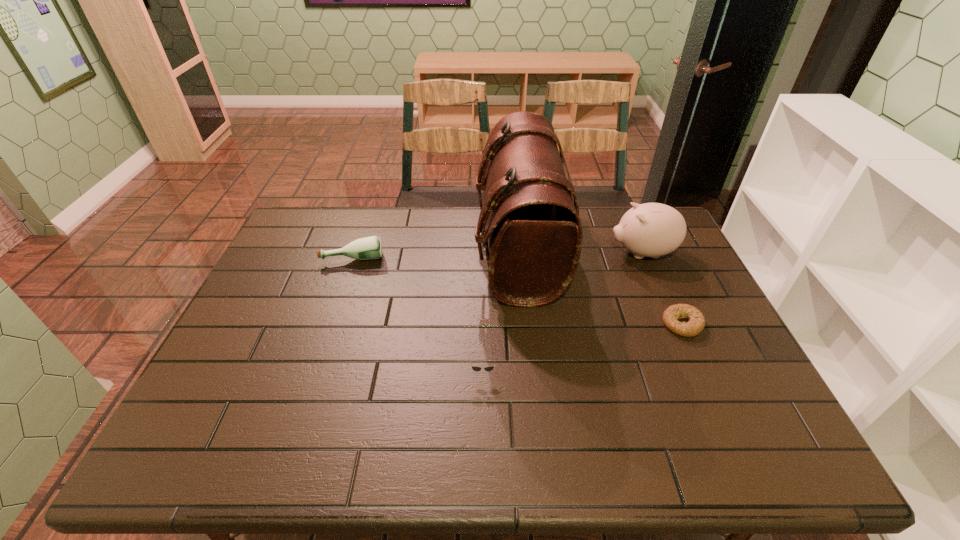
Identify the location of satchel. [x=533, y=229].

The height and width of the screenshot is (540, 960). I want to click on piggy bank, so click(652, 230).

You are a GUI agent. You are given a task and a screenshot of the screen. Output one action in this format:
    pyautogui.click(x=<x>, y=<y>)
    Task: Click on the bottle
    The width and height of the screenshot is (960, 540).
    Given the screenshot: What is the action you would take?
    pyautogui.click(x=368, y=248)

You are a GUI agent. You are given a task and a screenshot of the screen. Output one action in this format:
    pyautogui.click(x=<x>, y=<y>)
    Task: Click on the third shortest object
    
    Given the screenshot: What is the action you would take?
    pyautogui.click(x=368, y=248)

Find the location of a particular element. sunglasses is located at coordinates (476, 368).

Identify the location of the fourth tallest object. (476, 368).

Locate an element on the screen. This screenshot has height=540, width=960. the shortest object is located at coordinates (695, 325).

Locate an element on the screen. The image size is (960, 540). free space located 0.230m on the front-facing side of the satchel is located at coordinates (405, 251).

The width and height of the screenshot is (960, 540). Identify the location of vacant space located on the front-facing side of the satchel. (387, 251).

At what (x,y) coordinates should I click in order to perform the action: click on free region located 0.080m on the front-facing side of the satchel. Please return your answer as a coordinate pair (x, y). The width and height of the screenshot is (960, 540). Looking at the image, I should click on (451, 251).